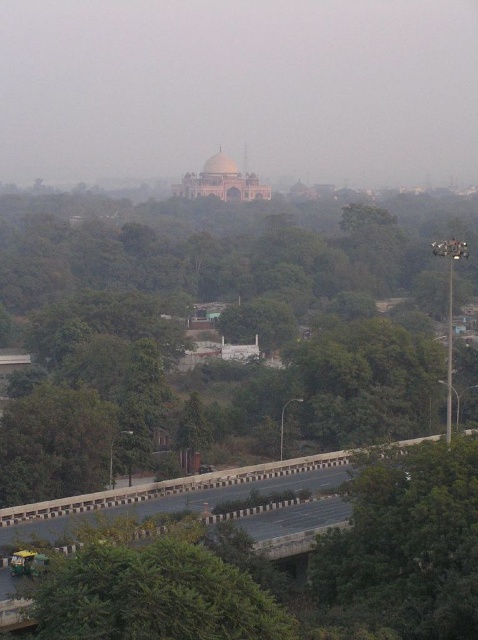
Image resolution: width=478 pixels, height=640 pixels. Find the location of `green leafy tree at lower right`. green leafy tree at lower right is located at coordinates (408, 544).

Looking at this image, does green leafy tree at lower right appear on the left side of green leafy tree at lower center?

Incorrect, green leafy tree at lower right is not on the left side of green leafy tree at lower center.

Is point (425, 588) positioned before point (155, 636)?

No, it is not.

The width and height of the screenshot is (478, 640). Identify the location of green leafy tree at lower right. (408, 544).

Which is above, green leafy tree at center or green leafy tree at lower right?

green leafy tree at center

Can you confirm if green leafy tree at center is bigger than green leafy tree at lower right?

Indeed, green leafy tree at center has a larger size compared to green leafy tree at lower right.

Is point (356, 259) less distant than point (420, 544)?

No, it is not.

Find the location of `green leafy tree at center`. green leafy tree at center is located at coordinates (249, 316).

Between green leafy tree at lower center and asphalt road at lower center, which one has more height?

asphalt road at lower center

Locate an element on the screen. This screenshot has width=478, height=640. green leafy tree at lower center is located at coordinates (154, 595).